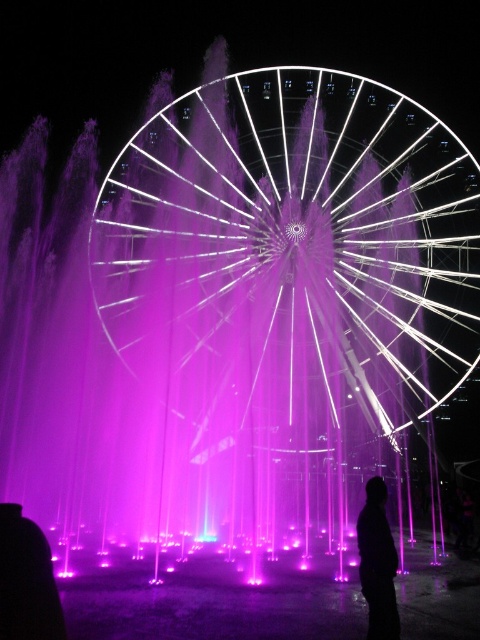
Question: Can you confirm if white metallic ferris wheel at center is positioned to the right of black matte silhouette at lower right?

Choices:
 (A) yes
 (B) no

Answer: (B)

Question: Where is white metallic ferris wheel at center located in relation to black matte silhouette at lower right in the image?

Choices:
 (A) above
 (B) below

Answer: (A)

Question: Which object appears closest to the camera in this image?

Choices:
 (A) white metallic ferris wheel at center
 (B) black matte silhouette at lower right

Answer: (B)

Question: Does white metallic ferris wheel at center have a smaller size compared to black matte silhouette at lower right?

Choices:
 (A) yes
 (B) no

Answer: (B)